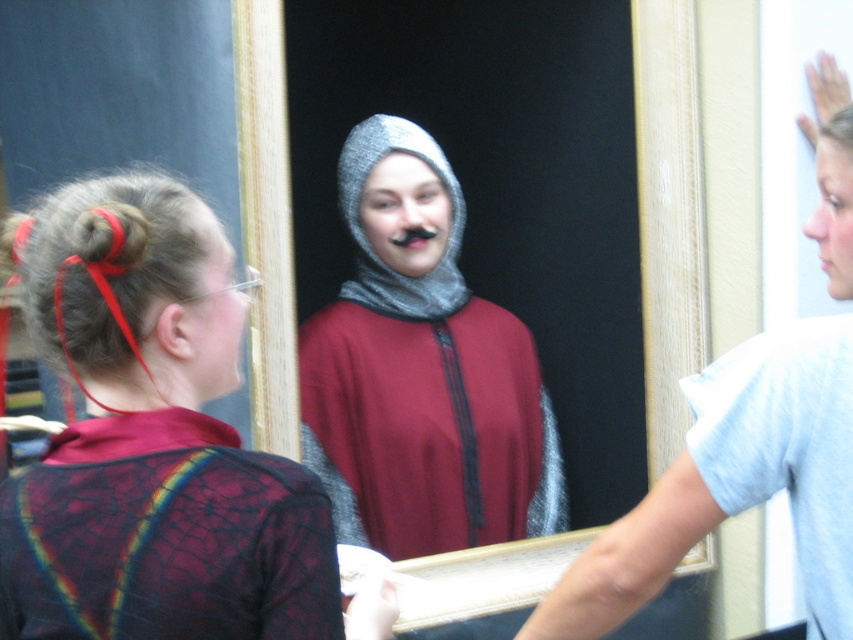
Question: Does knitted woolen cap at center appear on the left side of light blue cotton t-shirt at right?

Choices:
 (A) no
 (B) yes

Answer: (B)

Question: Can you confirm if crinkled fabric robe at center is positioned above matte black hair at center?

Choices:
 (A) yes
 (B) no

Answer: (B)

Question: Which of the following is the closest to the observer?

Choices:
 (A) matte black hair at center
 (B) crinkled fabric robe at center
 (C) smooth skin face at upper right

Answer: (B)

Question: Which point is closer to the camera taking this photo?

Choices:
 (A) (817, 221)
 (B) (230, 381)

Answer: (B)

Question: Is knitted woolen cap at center wider than matte black hair at center?

Choices:
 (A) yes
 (B) no

Answer: (A)

Question: Which of the following is the closest to the observer?

Choices:
 (A) gray metallic chainmail at center
 (B) light blue cotton t-shirt at right

Answer: (B)